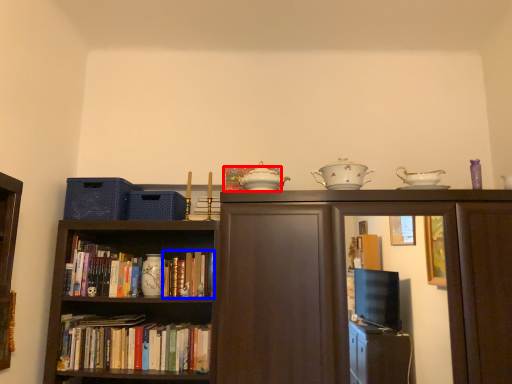
Question: Which point is closer to the camera, book (highlighted by a red box) or book (highlighted by a blue box)?

Choices:
 (A) book
 (B) book

Answer: (A)